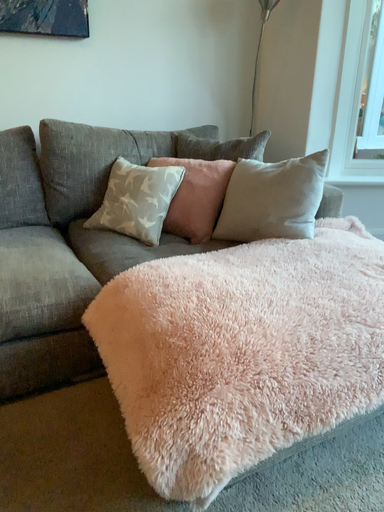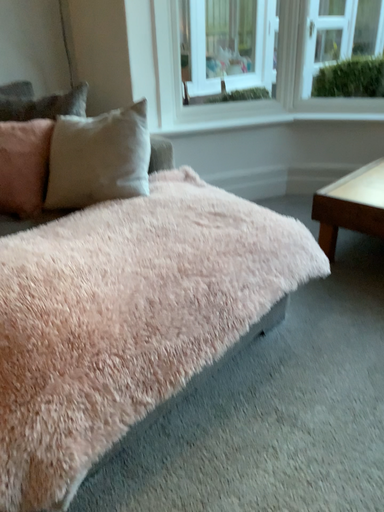
Question: Which way did the camera rotate in the video?

Choices:
 (A) rotated left
 (B) rotated right

Answer: (B)